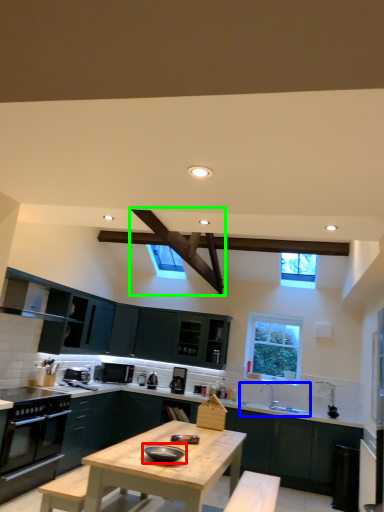
Question: Which object is the closest to the appliance (highlighted by a red box)? Choose among these: sink (highlighted by a blue box) or exhaust hood (highlighted by a green box).

Choices:
 (A) sink
 (B) exhaust hood

Answer: (B)